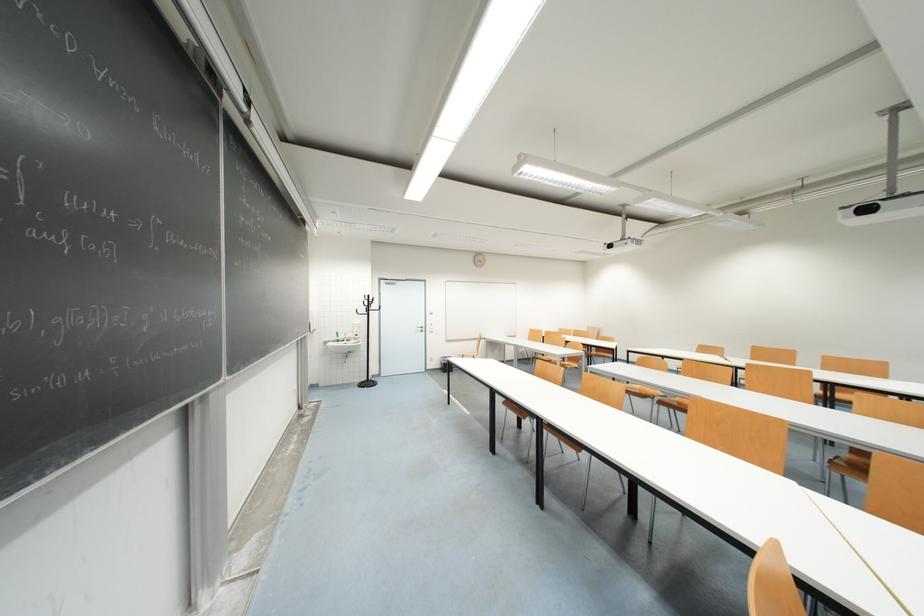
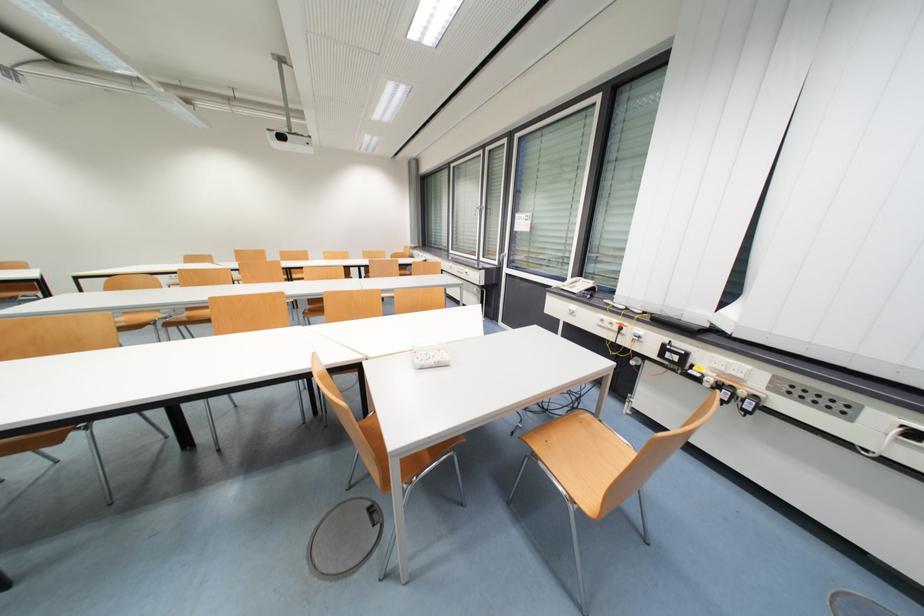
The first image is from the beginning of the video and the second image is from the end. How did the camera likely rotate when shooting the video?

The camera rotated toward right-down.